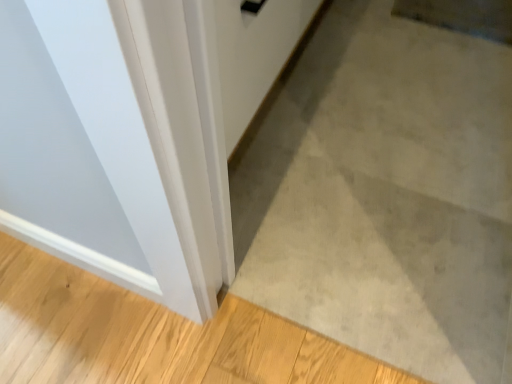
What is the approximate height of gray concrete at center?

gray concrete at center is 1.61 inches in height.

Find the location of a particular element. This screenshot has width=512, height=384. gray concrete at center is located at coordinates (387, 195).

The width and height of the screenshot is (512, 384). What do you see at coordinates (387, 195) in the screenshot? I see `gray concrete at center` at bounding box center [387, 195].

Measure the distance between gray concrete at center and camera.

They are 32.50 inches apart.

The height and width of the screenshot is (384, 512). In order to click on gray concrete at center in this screenshot , I will do `click(387, 195)`.